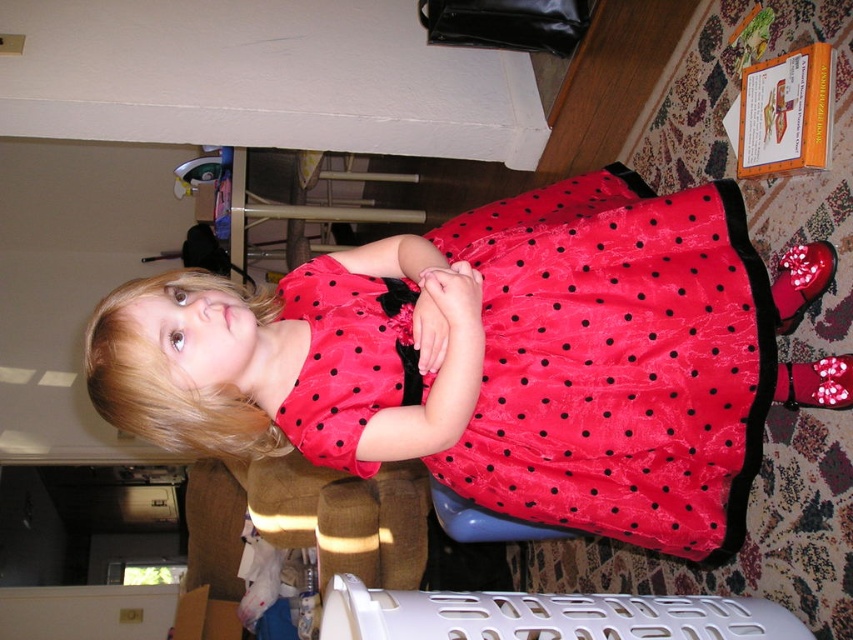
Is red satin dress at center behind white plastic laundry basket at lower center?

Yes, red satin dress at center is further from the viewer.

This screenshot has height=640, width=853. What are the coordinates of `red satin dress at center` in the screenshot? It's located at (618, 362).